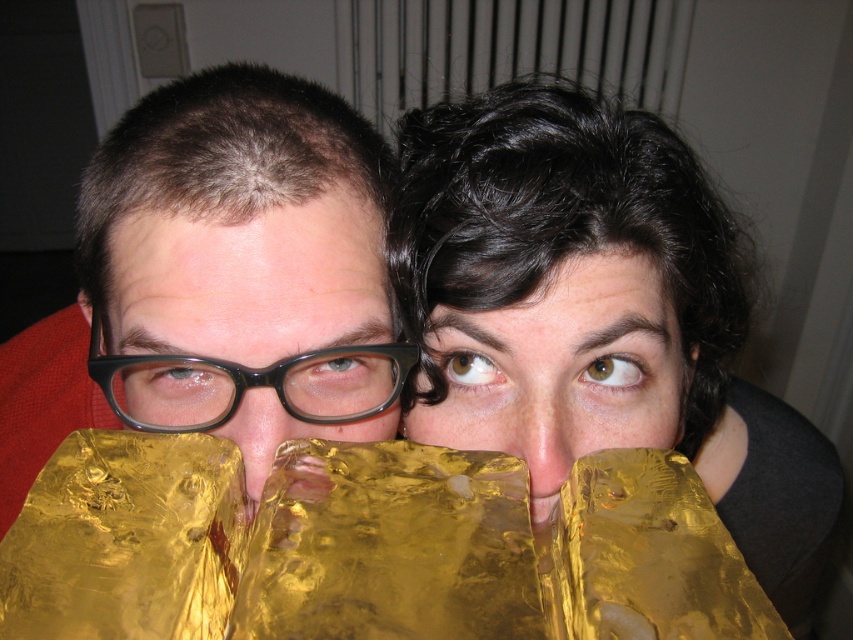
Describe the element at coordinates (218, 282) in the screenshot. I see `gold foil at left` at that location.

This screenshot has height=640, width=853. What do you see at coordinates (218, 282) in the screenshot?
I see `gold foil at left` at bounding box center [218, 282].

At what (x,y) coordinates should I click in order to perform the action: click on gold foil at left. Please return your answer as a coordinate pair (x, y). The width and height of the screenshot is (853, 640). Looking at the image, I should click on (218, 282).

Between point (654, 202) and point (469, 324), which one is positioned behind?

The point (654, 202) is more distant.

This screenshot has width=853, height=640. What do you see at coordinates (598, 314) in the screenshot?
I see `shiny gold foil at upper right` at bounding box center [598, 314].

This screenshot has height=640, width=853. Identify the location of shiny gold foil at upper right. (598, 314).

Is shiny gold foil at upper right taller than gold foil at left?

Yes.

The height and width of the screenshot is (640, 853). What are the coordinates of `shiny gold foil at upper right` in the screenshot? It's located at (598, 314).